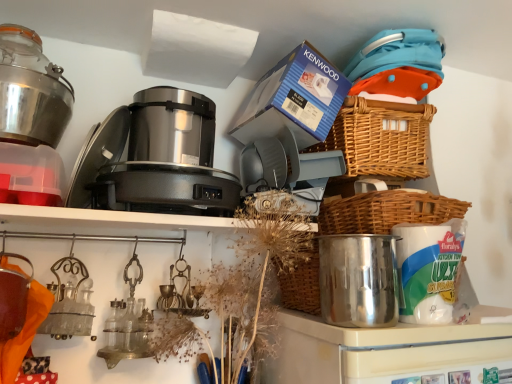
In order to face blue cardboard box at upper center, should I rotate leftwards or rightwards?

Turn right by 4.165 degrees to look at blue cardboard box at upper center.

What do you see at coordinates (293, 128) in the screenshot?
I see `blue cardboard box at upper center` at bounding box center [293, 128].

This screenshot has height=384, width=512. What do you see at coordinates (172, 127) in the screenshot? I see `satin metallic food processor at center, which is the first appliance from top to bottom` at bounding box center [172, 127].

Describe the element at coordinates (358, 280) in the screenshot. The height and width of the screenshot is (384, 512). I see `shiny metallic pot at center-right, acting as the second appliance starting from the back` at that location.

Locate an element on the screen. This screenshot has width=512, height=384. metallic glass jar at upper left is located at coordinates (31, 90).

What do you see at coordinates (380, 138) in the screenshot? The width and height of the screenshot is (512, 384). I see `woven brown basket at upper right, the 1th basket when ordered from top to bottom` at bounding box center [380, 138].

Locate an element on the screen. Image resolution: width=512 pixels, height=384 pixels. woven brown basket at right, the 2th basket from the top is located at coordinates (386, 211).

Considering the relative sizes of satin metallic food processor at center, which is the 2th appliance from bottom to top, and woven brown basket at right, the 2th basket from the top, in the image provided, is satin metallic food processor at center, which is the 2th appliance from bottom to top, thinner than woven brown basket at right, the 2th basket from the top,?

Indeed, satin metallic food processor at center, which is the 2th appliance from bottom to top, has a lesser width compared to woven brown basket at right, the 2th basket from the top.

Who is shorter, satin metallic food processor at center, which is the first appliance from left to right, or woven brown basket at right, the 2th basket from the top?

With less height is woven brown basket at right, the 2th basket from the top.

Is satin metallic food processor at center, marked as the 2th appliance in a right-to-left arrangement, at the left side of woven brown basket at right, the 2th basket from the top?

Indeed, satin metallic food processor at center, marked as the 2th appliance in a right-to-left arrangement, is positioned on the left side of woven brown basket at right, the 2th basket from the top.

Is metallic glass jar at upper left oriented towards woven brown basket at right, the 2th basket from the top?

No.

Considering the relative sizes of metallic glass jar at upper left and woven brown basket at right, the 2th basket from the top, in the image provided, is metallic glass jar at upper left smaller than woven brown basket at right, the 2th basket from the top,?

Yes.

Is metallic glass jar at upper left not inside woven brown basket at right, arranged as the first basket when ordered from the bottom?

Absolutely, metallic glass jar at upper left is external to woven brown basket at right, arranged as the first basket when ordered from the bottom.

From the image's perspective, is metallic glass jar at upper left over woven brown basket at right, arranged as the first basket when ordered from the bottom?

Yes.

Considering the sizes of shiny metallic pot at center-right, marked as the 1th appliance in a right-to-left arrangement, and metallic glass jar at upper left in the image, is shiny metallic pot at center-right, marked as the 1th appliance in a right-to-left arrangement, taller or shorter than metallic glass jar at upper left?

Considering their sizes, shiny metallic pot at center-right, marked as the 1th appliance in a right-to-left arrangement, has more height than metallic glass jar at upper left.

Does shiny metallic pot at center-right, the 1th appliance in the front-to-back sequence, have a greater width compared to metallic glass jar at upper left?

Incorrect, the width of shiny metallic pot at center-right, the 1th appliance in the front-to-back sequence, does not surpass that of metallic glass jar at upper left.

Looking at this image, does shiny metallic pot at center-right, acting as the second appliance starting from the back, turn towards metallic glass jar at upper left?

No, shiny metallic pot at center-right, acting as the second appliance starting from the back, is not oriented towards metallic glass jar at upper left.

From the image's perspective, which one is positioned lower, shiny metallic pot at center-right, acting as the second appliance starting from the back, or metallic glass jar at upper left?

shiny metallic pot at center-right, acting as the second appliance starting from the back, is shown below in the image.

Which object is closer to the camera, metallic glass jar at upper left or blue cardboard box at upper center?

metallic glass jar at upper left is more forward.

From the image's perspective, would you say metallic glass jar at upper left is positioned over blue cardboard box at upper center?

Actually, metallic glass jar at upper left appears below blue cardboard box at upper center in the image.

Which is closer to the camera, (x=62, y=127) or (x=300, y=171)?

Point (x=300, y=171)

Can you tell me how much satin metallic food processor at center, marked as the 2th appliance in a right-to-left arrangement, and blue cardboard box at upper center differ in facing direction?

The facing directions of satin metallic food processor at center, marked as the 2th appliance in a right-to-left arrangement, and blue cardboard box at upper center are 0.652 degrees apart.

Can you confirm if satin metallic food processor at center, placed as the first appliance when sorted from back to front, is taller than blue cardboard box at upper center?

Incorrect, the height of satin metallic food processor at center, placed as the first appliance when sorted from back to front, is not larger of that of blue cardboard box at upper center.

Would you say satin metallic food processor at center, the second appliance in the front-to-back sequence, is outside blue cardboard box at upper center?

Indeed, satin metallic food processor at center, the second appliance in the front-to-back sequence, is completely outside blue cardboard box at upper center.

From the image's perspective, is satin metallic food processor at center, which is the 2th appliance from bottom to top, located above or below blue cardboard box at upper center?

From the image's perspective, satin metallic food processor at center, which is the 2th appliance from bottom to top, appears below blue cardboard box at upper center.

Between woven brown basket at upper right, acting as the second basket starting from the bottom, and metallic glass jar at upper left, which one has smaller width?

Thinner between the two is metallic glass jar at upper left.

Considering the relative positions of woven brown basket at upper right, acting as the second basket starting from the bottom, and metallic glass jar at upper left in the image provided, is woven brown basket at upper right, acting as the second basket starting from the bottom, to the left or to the right of metallic glass jar at upper left?

woven brown basket at upper right, acting as the second basket starting from the bottom, is positioned on metallic glass jar at upper left's right side.

From a real-world perspective, is woven brown basket at upper right, the 1th basket when ordered from top to bottom, located higher than metallic glass jar at upper left?

No.

From a real-world perspective, starting from the metallic glass jar at upper left, which basket is the 1st one below it? Please provide its 2D coordinates.

[(380, 138)]

From the image's perspective, is blue cardboard box at upper center on top of woven brown basket at upper right, the 1th basket when ordered from top to bottom?

Yes.

Is blue cardboard box at upper center taller or shorter than woven brown basket at upper right, acting as the second basket starting from the bottom?

blue cardboard box at upper center is taller than woven brown basket at upper right, acting as the second basket starting from the bottom.

Is blue cardboard box at upper center inside or outside of woven brown basket at upper right, the 1th basket when ordered from top to bottom?

blue cardboard box at upper center is not enclosed by woven brown basket at upper right, the 1th basket when ordered from top to bottom.

Considering the relative sizes of blue cardboard box at upper center and woven brown basket at upper right, acting as the second basket starting from the bottom, in the image provided, is blue cardboard box at upper center bigger than woven brown basket at upper right, acting as the second basket starting from the bottom,?

Yes, blue cardboard box at upper center is bigger than woven brown basket at upper right, acting as the second basket starting from the bottom.

Find the location of `appliance that is the 2nd one when counting leftward from the woven brown basket at right, arranged as the first basket when ordered from the bottom`. appliance that is the 2nd one when counting leftward from the woven brown basket at right, arranged as the first basket when ordered from the bottom is located at coordinates (172, 127).

This screenshot has height=384, width=512. In order to click on kitchen appliance that appears in front of the woven brown basket at right, the 2th basket from the top in this screenshot , I will do `click(31, 90)`.

Based on the photo, estimate the real-world distances between objects in this image. Which object is closer to metallic glass jar at upper left, woven brown basket at upper right, acting as the second basket starting from the bottom, or satin metallic food processor at center, which is the 2th appliance from bottom to top?

satin metallic food processor at center, which is the 2th appliance from bottom to top, is positioned closer to the anchor metallic glass jar at upper left.

Which object lies further to the anchor point woven brown basket at right, the 2th basket from the top, blue cardboard box at upper center or woven brown basket at upper right, the 1th basket when ordered from top to bottom?

blue cardboard box at upper center is further to woven brown basket at right, the 2th basket from the top.

From the picture: Looking at the image, which one is located closer to shiny metallic pot at center-right, acting as the second appliance starting from the top, woven brown basket at upper right, acting as the second basket starting from the bottom, or woven brown basket at right, the 2th basket from the top?

woven brown basket at right, the 2th basket from the top, lies closer to shiny metallic pot at center-right, acting as the second appliance starting from the top, than the other object.

Looking at the image, which one is located closer to metallic glass jar at upper left, woven brown basket at upper right, the 1th basket when ordered from top to bottom, or woven brown basket at right, the 2th basket from the top?

Based on the image, woven brown basket at upper right, the 1th basket when ordered from top to bottom, appears to be nearer to metallic glass jar at upper left.

Considering their positions, is satin metallic food processor at center, marked as the 2th appliance in a right-to-left arrangement, positioned further to metallic glass jar at upper left than shiny metallic pot at center-right, acting as the second appliance starting from the top?

Among the two, shiny metallic pot at center-right, acting as the second appliance starting from the top, is located further to metallic glass jar at upper left.

When comparing their distances from metallic glass jar at upper left, does shiny metallic pot at center-right, which is the second appliance in left-to-right order, or woven brown basket at right, arranged as the first basket when ordered from the bottom, seem closer?

The object closer to metallic glass jar at upper left is shiny metallic pot at center-right, which is the second appliance in left-to-right order.

Looking at the image, which one is located further to blue cardboard box at upper center, woven brown basket at upper right, acting as the second basket starting from the bottom, or satin metallic food processor at center, marked as the 2th appliance in a right-to-left arrangement?

The object further to blue cardboard box at upper center is satin metallic food processor at center, marked as the 2th appliance in a right-to-left arrangement.

From the image, which object appears to be farther from woven brown basket at right, arranged as the first basket when ordered from the bottom, metallic glass jar at upper left or shiny metallic pot at center-right, acting as the second appliance starting from the back?

metallic glass jar at upper left.

Where is `coffee machine situated between metallic glass jar at upper left and woven brown basket at right, arranged as the first basket when ordered from the bottom, from left to right`? This screenshot has height=384, width=512. coffee machine situated between metallic glass jar at upper left and woven brown basket at right, arranged as the first basket when ordered from the bottom, from left to right is located at coordinates (293, 128).

The width and height of the screenshot is (512, 384). What are the coordinates of `coffee machine between satin metallic food processor at center, placed as the first appliance when sorted from back to front, and woven brown basket at right, arranged as the first basket when ordered from the bottom, from left to right` in the screenshot? It's located at (293, 128).

The image size is (512, 384). What are the coordinates of `coffee machine situated between metallic glass jar at upper left and woven brown basket at upper right, acting as the second basket starting from the bottom, from left to right` in the screenshot? It's located at (293, 128).

The image size is (512, 384). In order to click on appliance between metallic glass jar at upper left and shiny metallic pot at center-right, marked as the 1th appliance in a right-to-left arrangement, in the horizontal direction in this screenshot , I will do `click(172, 127)`.